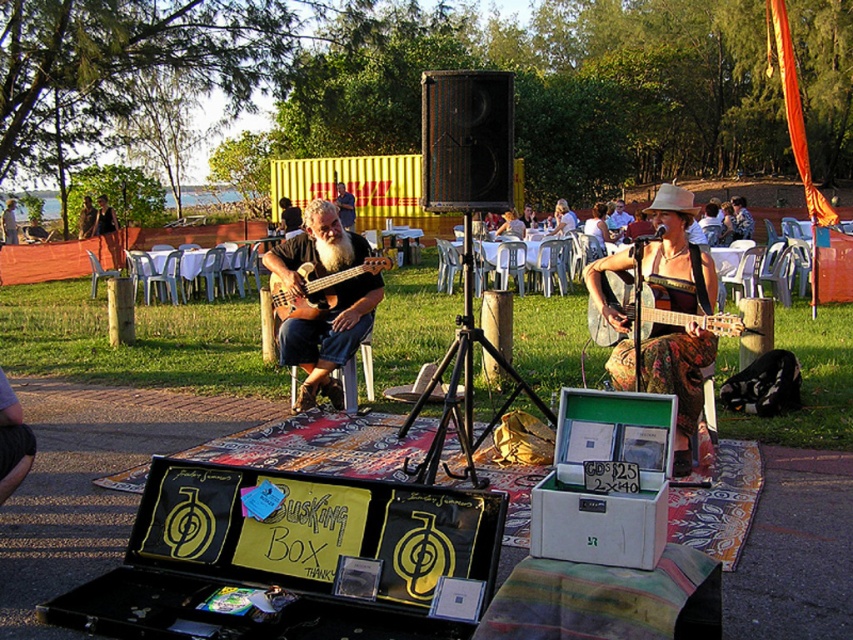
Question: Can you confirm if matte brown guitar at center is thinner than wooden acoustic guitar at center?

Choices:
 (A) yes
 (B) no

Answer: (B)

Question: Which object is positioned farthest from the matte brown guitar at center?

Choices:
 (A) wooden acoustic guitar at center
 (B) floral fabric guitar at center
 (C) brown wood guitar at center

Answer: (B)

Question: Is matte brown guitar at center thinner than brown wood guitar at center?

Choices:
 (A) yes
 (B) no

Answer: (A)

Question: Which object appears closest to the camera in this image?

Choices:
 (A) floral fabric guitar at center
 (B) brown wood guitar at center
 (C) matte brown guitar at center
 (D) wooden acoustic guitar at center

Answer: (A)

Question: Where is floral fabric guitar at center located in relation to wooden acoustic guitar at center in the image?

Choices:
 (A) below
 (B) above

Answer: (A)

Question: Which point is farther to the camera?

Choices:
 (A) (302, 269)
 (B) (645, 308)
 (C) (306, 344)
 (D) (697, 356)

Answer: (A)